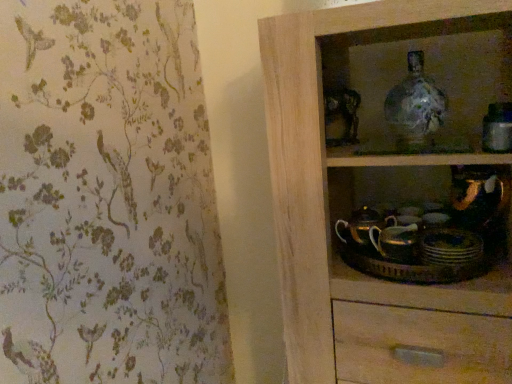
The image size is (512, 384). Describe the element at coordinates (393, 191) in the screenshot. I see `wooden cupboard at right` at that location.

At what (x,y) coordinates should I click in order to perform the action: click on wooden cupboard at right. Please return your answer as a coordinate pair (x, y). This screenshot has height=384, width=512. Looking at the image, I should click on (393, 191).

This screenshot has width=512, height=384. Identify the location of wooden cupboard at right. point(393,191).